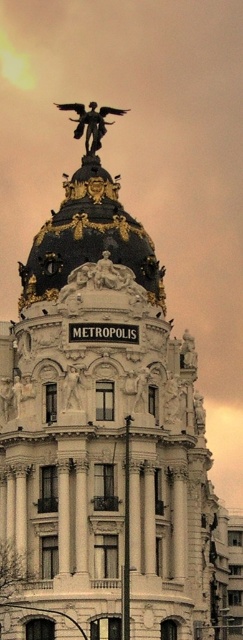
Which of these two, bronze/golden statue at top center or white marble statue at center, stands taller?

Standing taller between the two is bronze/golden statue at top center.

Who is positioned more to the left, bronze/golden statue at top center or white marble statue at center?

From the viewer's perspective, white marble statue at center appears more on the left side.

Is point (95, 116) behind point (64, 388)?

Yes, point (95, 116) is behind point (64, 388).

Identify the location of bronze/golden statue at top center. (90, 122).